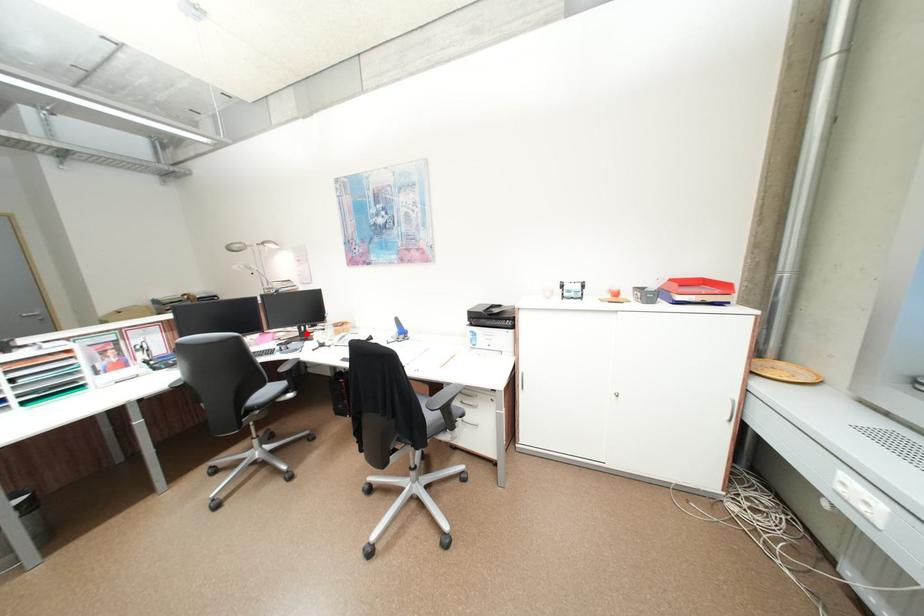
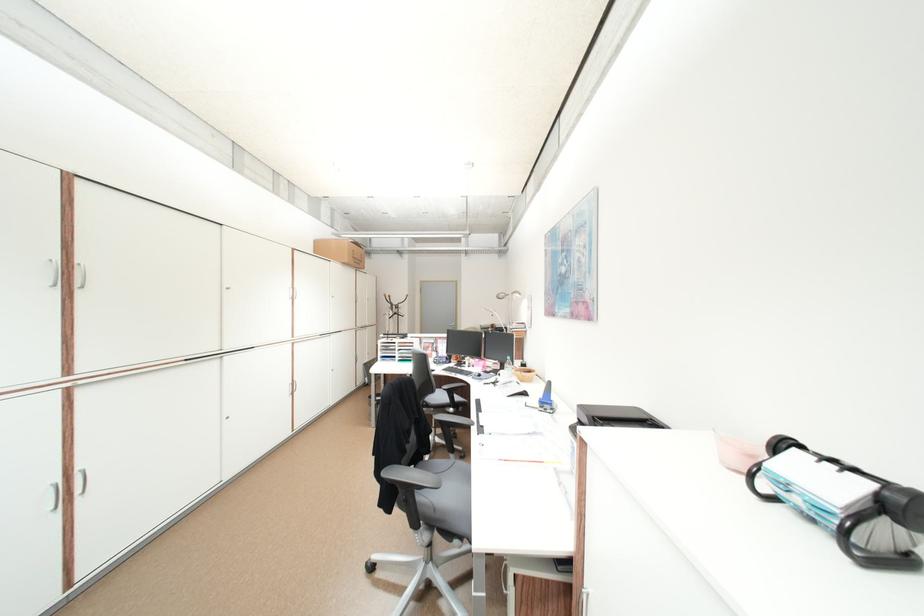
The point at the highlighted location is marked in the first image. Where is the corresponding point in the second image?

(507, 368)